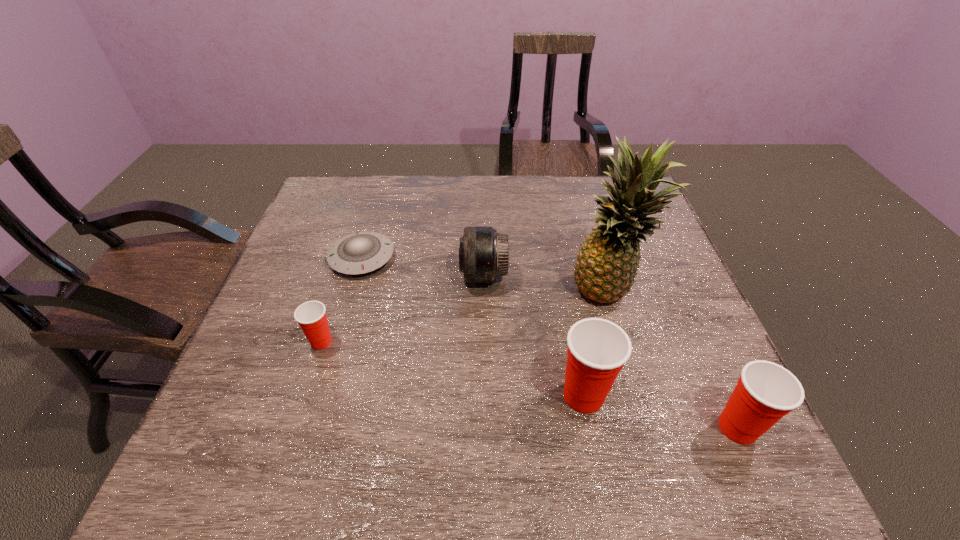
Where is `object positioned at the near right corner`? object positioned at the near right corner is located at coordinates click(x=765, y=392).

Where is `vacant space at the far edge`? The height and width of the screenshot is (540, 960). vacant space at the far edge is located at coordinates (571, 214).

This screenshot has height=540, width=960. Identify the location of free space at the near edge. (582, 426).

In the image, there is a desktop. At what (x,y) coordinates should I click in order to perform the action: click on vacant space at the left edge. Please return your answer as a coordinate pair (x, y). Looking at the image, I should click on (255, 322).

At what (x,y) coordinates should I click in order to perform the action: click on free space at the right edge of the desktop. Please return your answer as a coordinate pair (x, y). This screenshot has height=540, width=960. Looking at the image, I should click on (681, 381).

Locate an element on the screen. vacant space at the near left corner is located at coordinates (255, 400).

Find the location of a particular element. This screenshot has height=540, width=960. unoccupied area between the tallest object and the telephoto lens is located at coordinates (545, 284).

Find the location of `unoccupied area between the saucer and the farthest Dixie cup`. unoccupied area between the saucer and the farthest Dixie cup is located at coordinates (342, 300).

Where is `empty location between the shortest object and the fifth tallest object`? Image resolution: width=960 pixels, height=540 pixels. empty location between the shortest object and the fifth tallest object is located at coordinates (342, 300).

In order to click on free spot between the second shortest object and the second Dixie cup from left to right in this screenshot , I will do `click(452, 368)`.